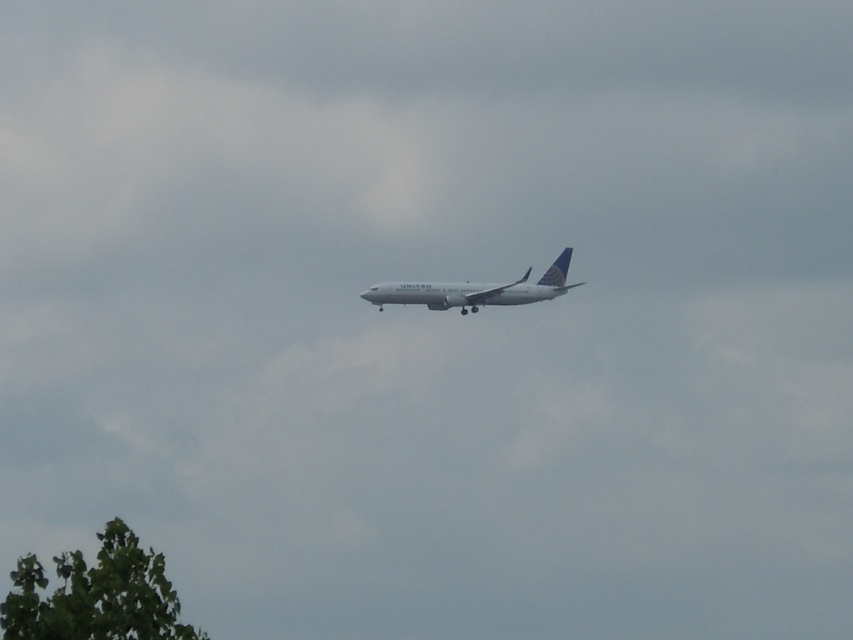
Question: Where is green leafy tree at lower left located in relation to white matte airplane at center in the image?

Choices:
 (A) below
 (B) above

Answer: (A)

Question: Is green leafy tree at lower left above white matte airplane at center?

Choices:
 (A) yes
 (B) no

Answer: (B)

Question: Which point is farther to the camera?

Choices:
 (A) green leafy tree at lower left
 (B) white matte airplane at center

Answer: (B)

Question: Is green leafy tree at lower left thinner than white matte airplane at center?

Choices:
 (A) yes
 (B) no

Answer: (A)